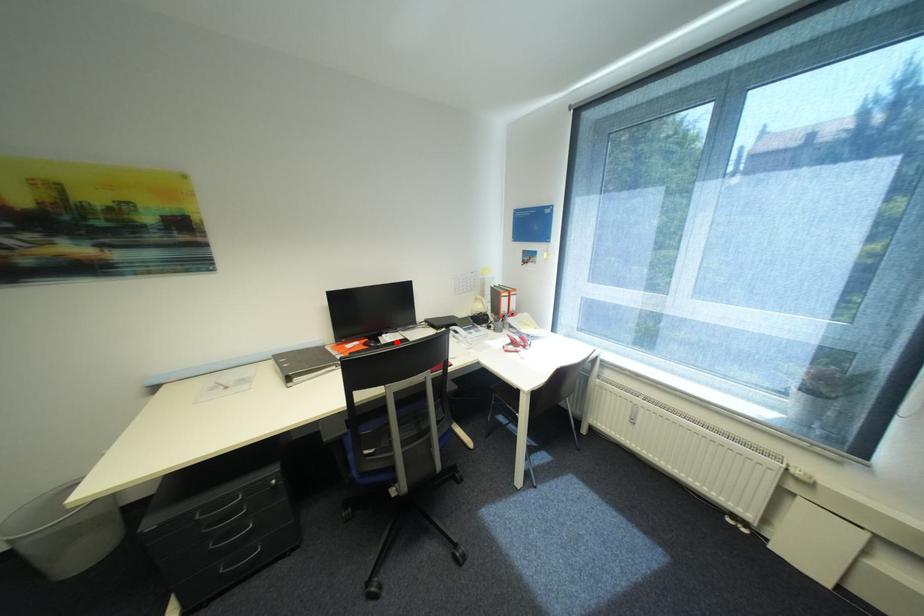
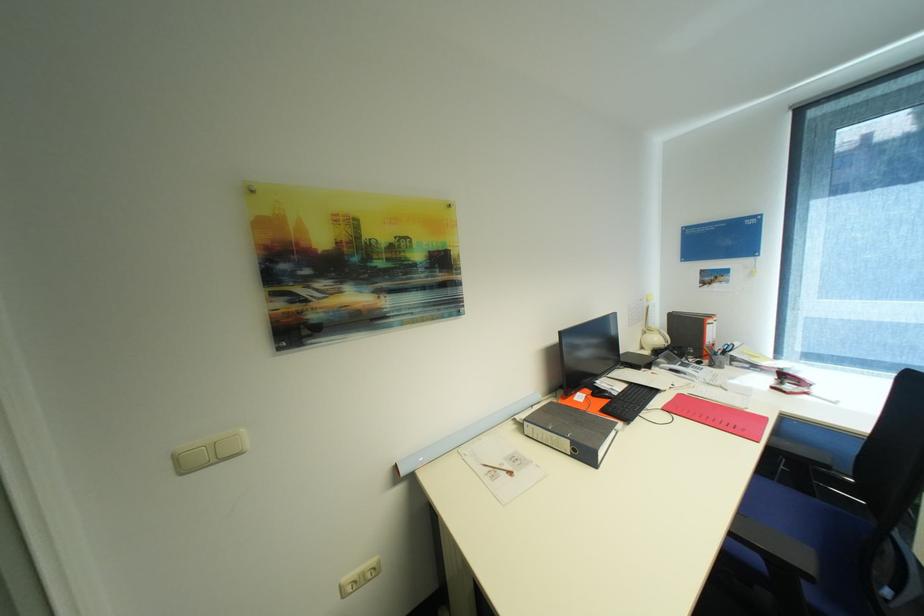
Question: I am providing you with two images of the same scene from different viewpoints. In image1, a red point is highlighted. Considering the same 3D point in image2, which of the following is correct?

Choices:
 (A) It is closer
 (B) It is farther

Answer: (A)